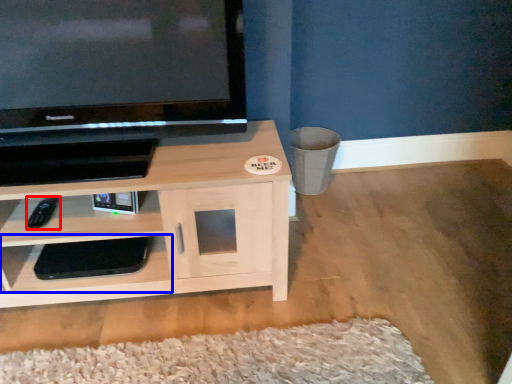
Question: Which object appears closest to the camera in this image, remote (highlighted by a red box) or shelf (highlighted by a blue box)?

Choices:
 (A) remote
 (B) shelf

Answer: (A)